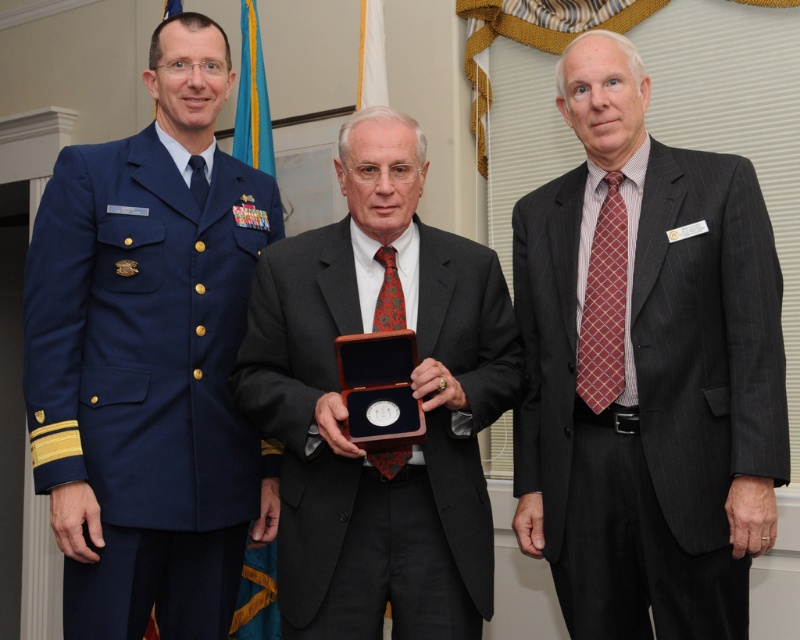
You are a photographer adjusting your camera to focus on two specific points in the image. The first point is at coordinates point (x=676, y=624) and the second point is at coordinates point (x=193, y=156). Which point should you focus on first if you want to capture the nearest object to the camera?

Point (x=676, y=624) is closer to the camera than point (x=193, y=156), so you should focus on point (x=676, y=624) first to capture the nearest object.

You are a photographer setting up for a group photo. You need to arrange the blue fabric uniform at left and the matte black suit at center so that both subjects are visible in the frame. Considering their heights, which subject should you position closer to the camera to ensure their faces are visible without obstruction?

The blue fabric uniform at left is much taller than the matte black suit at center. To ensure both faces are visible, position the matte black suit at center closer to the camera since the shorter subject needs to be nearer to avoid being obscured by the taller individual.

Looking at this image, you are a photographer at a formal event and need to adjust the camera settings to ensure both the dark gray pinstripe suit at right and the matte black suit at center are in focus. Considering their heights, which suit will require you to adjust the focus higher?

The dark gray pinstripe suit at right is much taller than the matte black suit at center, so you should adjust the focus higher for the dark gray pinstripe suit at right.